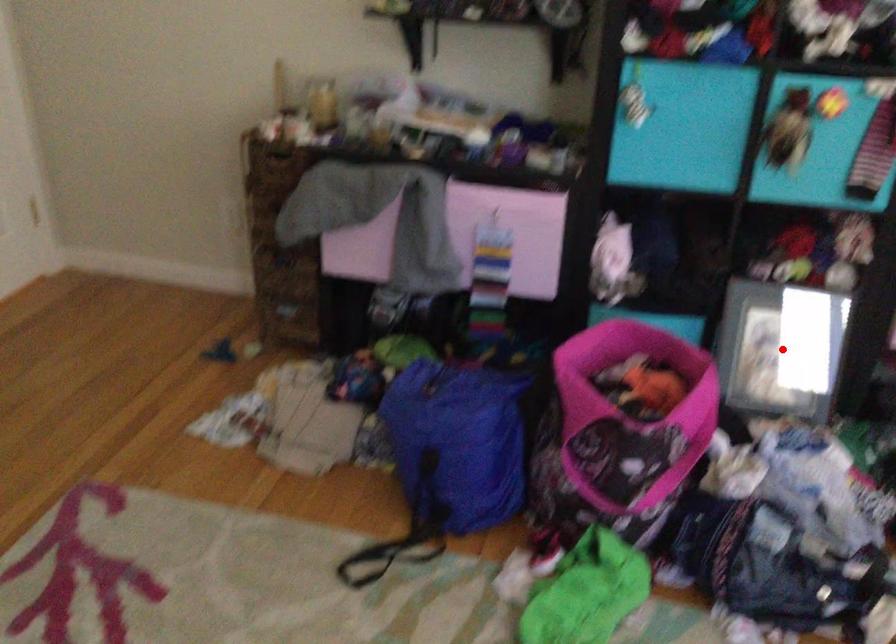
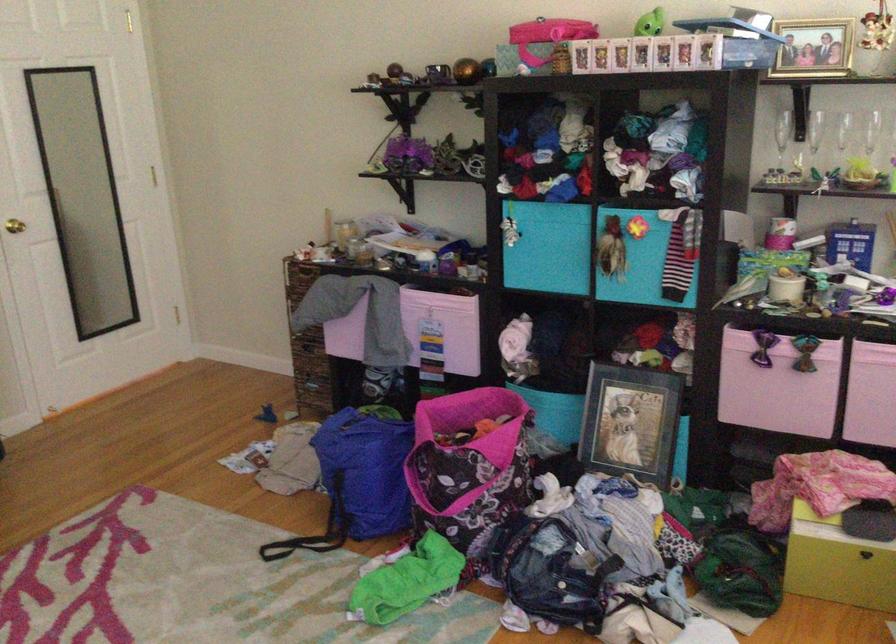
The point at the highlighted location is marked in the first image. Where is the corresponding point in the second image?

(631, 422)